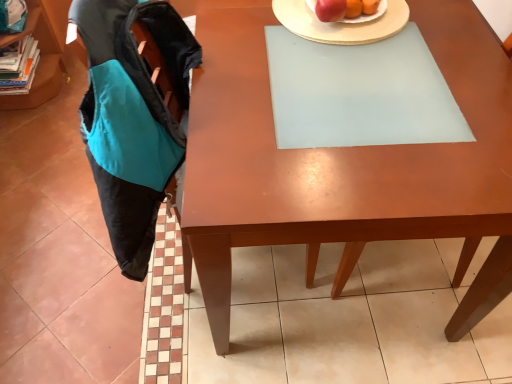
Question: Can you confirm if shiny red apple at upper center is smaller than matte wooden desk at center?

Choices:
 (A) no
 (B) yes

Answer: (B)

Question: Is shiny red apple at upper center wider than matte wooden desk at center?

Choices:
 (A) yes
 (B) no

Answer: (B)

Question: Is shiny red apple at upper center taller than matte wooden desk at center?

Choices:
 (A) no
 (B) yes

Answer: (A)

Question: Are shiny red apple at upper center and matte wooden desk at center far apart?

Choices:
 (A) yes
 (B) no

Answer: (B)

Question: From a real-world perspective, does shiny red apple at upper center stand above matte wooden desk at center?

Choices:
 (A) no
 (B) yes

Answer: (B)

Question: Does shiny red apple at upper center have a larger size compared to matte wooden desk at center?

Choices:
 (A) no
 (B) yes

Answer: (A)

Question: Does teal fabric book at left have a larger size compared to teal fabric shelf at upper left?

Choices:
 (A) no
 (B) yes

Answer: (A)

Question: Could teal fabric shelf at upper left be considered to be inside teal fabric book at left?

Choices:
 (A) yes
 (B) no

Answer: (B)

Question: From a real-world perspective, is teal fabric book at left below teal fabric shelf at upper left?

Choices:
 (A) yes
 (B) no

Answer: (A)

Question: From the image's perspective, would you say teal fabric book at left is positioned over teal fabric shelf at upper left?

Choices:
 (A) yes
 (B) no

Answer: (B)

Question: Does teal fabric book at left come in front of teal fabric shelf at upper left?

Choices:
 (A) no
 (B) yes

Answer: (A)

Question: From the image's perspective, is teal fabric book at left beneath teal fabric shelf at upper left?

Choices:
 (A) no
 (B) yes

Answer: (B)

Question: Is black fabric swivel chair at left positioned beyond the bounds of shiny red apple at upper center?

Choices:
 (A) yes
 (B) no

Answer: (A)